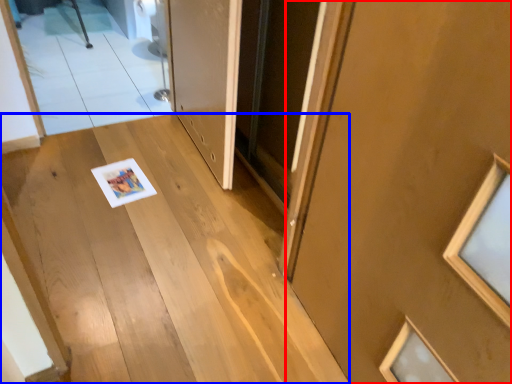
Question: Which point is closer to the camera, door (highlighted by a red box) or stairs (highlighted by a blue box)?

Choices:
 (A) door
 (B) stairs

Answer: (A)